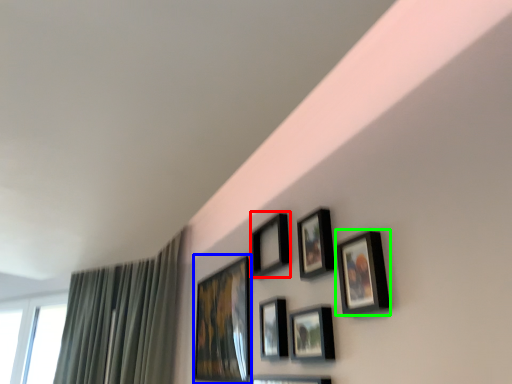
Question: Considering the real-world distances, which object is farthest from picture frame (highlighted by a red box)? picture frame (highlighted by a blue box) or picture frame (highlighted by a green box)?

Choices:
 (A) picture frame
 (B) picture frame

Answer: (B)